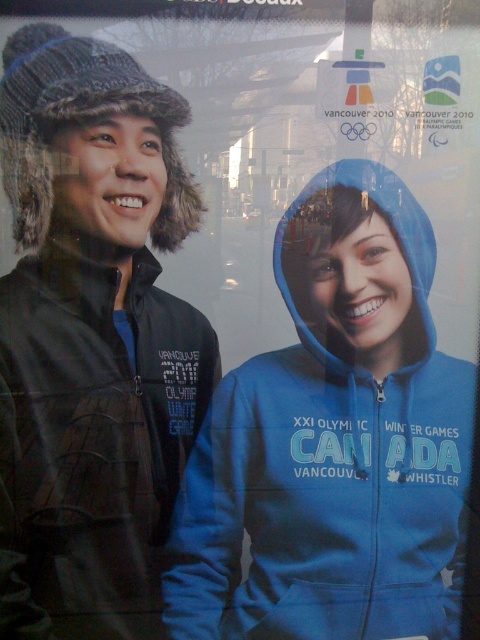
Question: Which object is farther from the camera taking this photo?

Choices:
 (A) matte black jacket at left
 (B) blue zip-up hoodie at center

Answer: (B)

Question: Considering the relative positions of matte black jacket at left and blue zip-up hoodie at center in the image provided, where is matte black jacket at left located with respect to blue zip-up hoodie at center?

Choices:
 (A) below
 (B) above

Answer: (B)

Question: In this image, where is matte black jacket at left located relative to blue zip-up hoodie at center?

Choices:
 (A) above
 (B) below

Answer: (A)

Question: Does matte black jacket at left appear over blue zip-up hoodie at center?

Choices:
 (A) no
 (B) yes

Answer: (B)